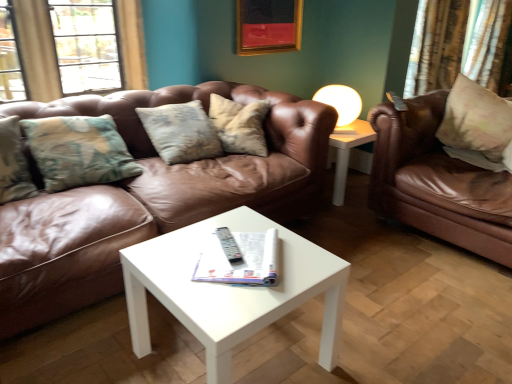
At what (x,y) coordinates should I click in order to perform the action: click on vacant space situated above white glossy coffee table at center (from a real-world perspective). Please return your answer as a coordinate pair (x, y). Looking at the image, I should click on (226, 257).